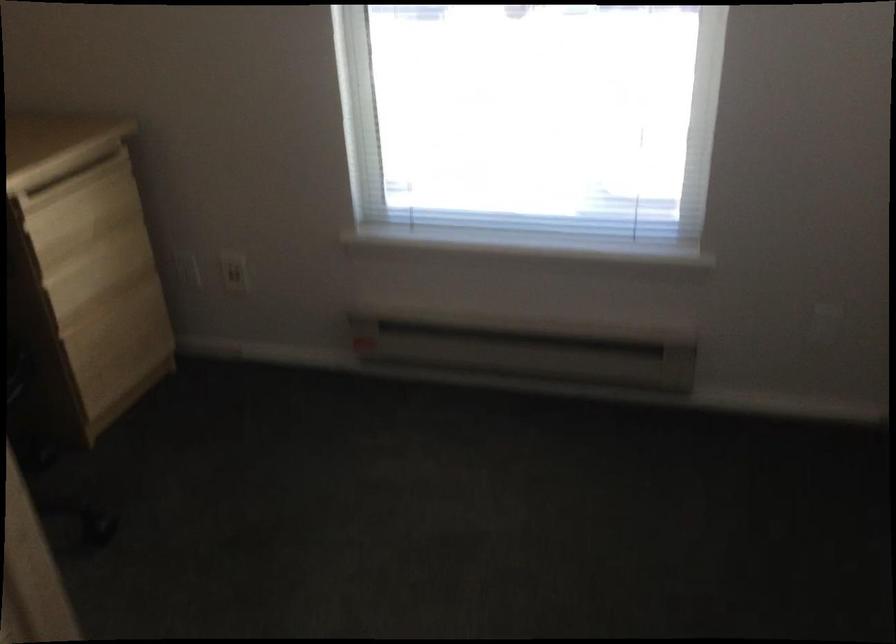
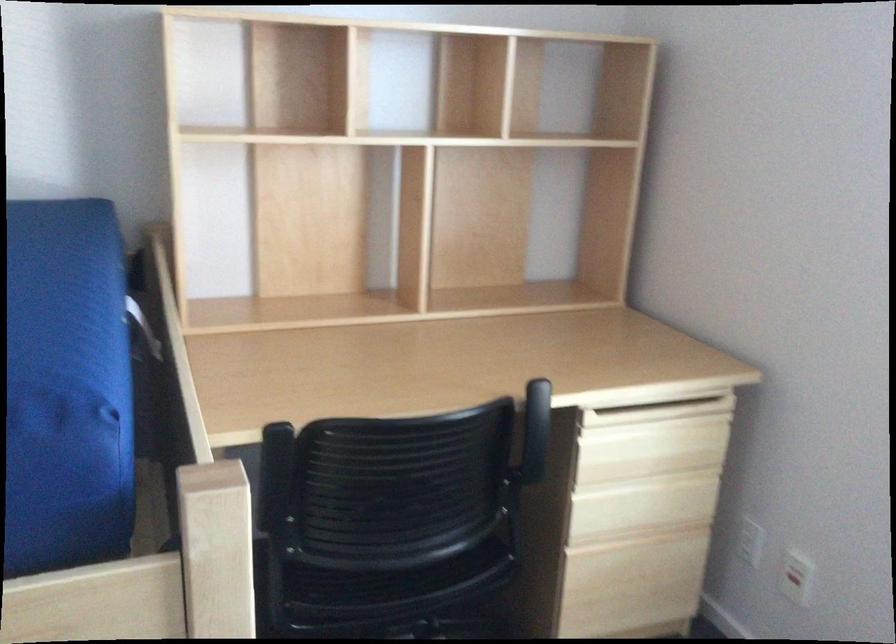
Where in the second image is the point corresponding to (x=236, y=270) from the first image?

(796, 576)